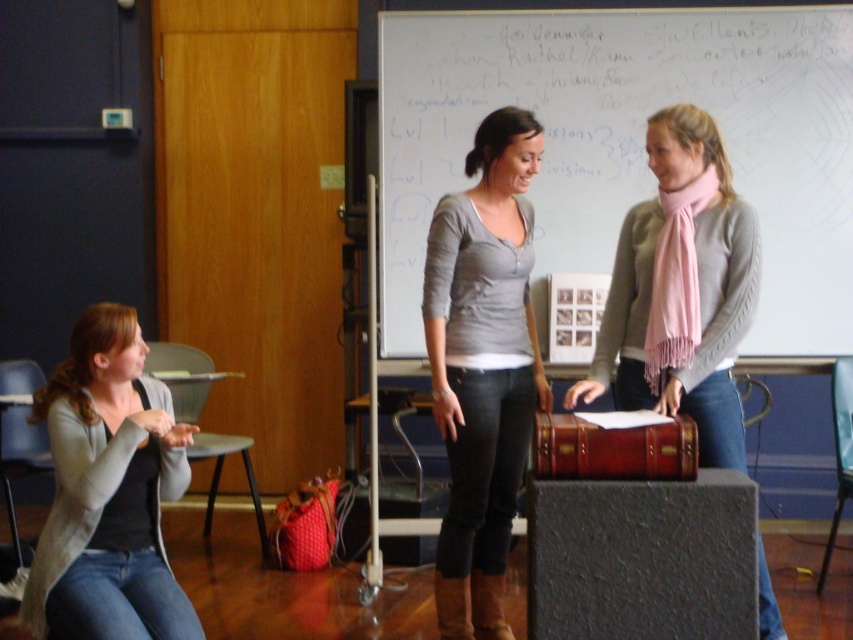
Question: Observing the image, what is the correct spatial positioning of matte gray shirt at center in reference to light gray sweater at center?

Choices:
 (A) left
 (B) right

Answer: (A)

Question: Does matte gray shirt at center appear on the left side of light gray sweater at center?

Choices:
 (A) yes
 (B) no

Answer: (A)

Question: Which of these objects is positioned farthest from the matte gray shirt at center?

Choices:
 (A) matte gray cardigan at lower left
 (B) light gray sweater at center

Answer: (A)

Question: Which point appears closest to the camera in this image?

Choices:
 (A) pyautogui.click(x=531, y=317)
 (B) pyautogui.click(x=73, y=486)
 (C) pyautogui.click(x=778, y=612)
 (D) pyautogui.click(x=624, y=136)

Answer: (B)

Question: Considering the relative positions of whiteboard at upper center and matte gray cardigan at lower left in the image provided, where is whiteboard at upper center located with respect to matte gray cardigan at lower left?

Choices:
 (A) below
 (B) above

Answer: (B)

Question: Which point is closer to the camera taking this photo?

Choices:
 (A) (138, 579)
 (B) (451, 420)
 (C) (679, 396)

Answer: (A)